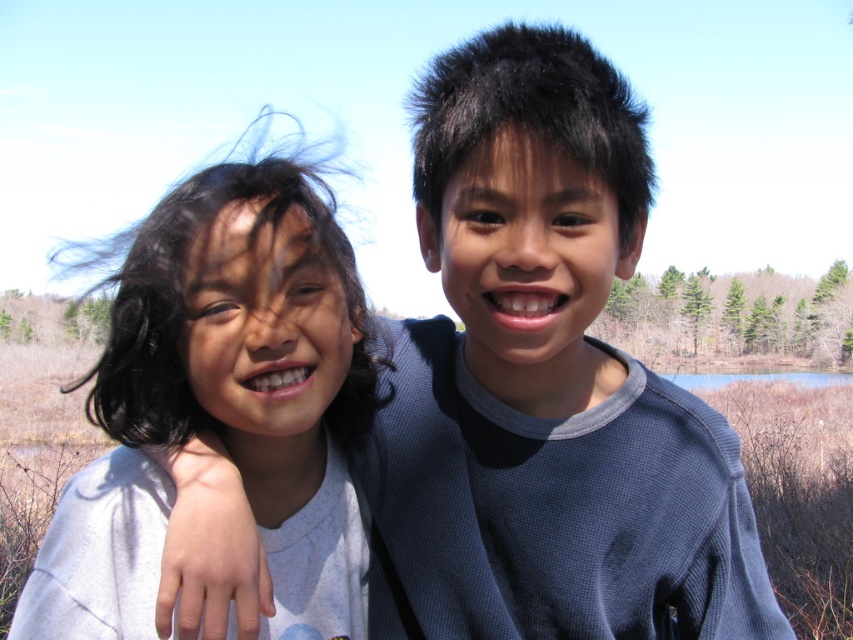
Question: Is gray thermal shirt at center thinner than white matte shirt at left?

Choices:
 (A) no
 (B) yes

Answer: (A)

Question: Considering the relative positions of gray thermal shirt at center and white matte shirt at left in the image provided, where is gray thermal shirt at center located with respect to white matte shirt at left?

Choices:
 (A) right
 (B) left

Answer: (A)

Question: Which object appears farthest from the camera in this image?

Choices:
 (A) white matte shirt at left
 (B) gray thermal shirt at center

Answer: (A)

Question: Which point is closer to the camera?

Choices:
 (A) white matte shirt at left
 (B) gray thermal shirt at center

Answer: (B)

Question: Can you confirm if gray thermal shirt at center is wider than white matte shirt at left?

Choices:
 (A) yes
 (B) no

Answer: (A)

Question: Which point is closer to the camera taking this photo?

Choices:
 (A) (247, 179)
 (B) (393, 541)

Answer: (A)